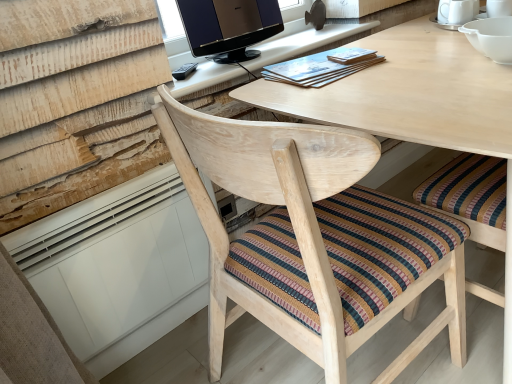
Question: From the image's perspective, is light wood computer desk at upper center beneath matte brown book at upper center, the 2th book from the left?

Choices:
 (A) yes
 (B) no

Answer: (B)

Question: Is light wood computer desk at upper center at the right side of matte brown book at upper center, the 2th book from the left?

Choices:
 (A) no
 (B) yes

Answer: (A)

Question: Is light wood computer desk at upper center not inside matte brown book at upper center, the 2th book from the left?

Choices:
 (A) yes
 (B) no

Answer: (A)

Question: Would you say light wood computer desk at upper center contains matte brown book at upper center, the first book positioned from the right?

Choices:
 (A) no
 (B) yes

Answer: (A)

Question: Is matte brown book at upper center, the first book positioned from the right, at the back of light wood computer desk at upper center?

Choices:
 (A) no
 (B) yes

Answer: (A)

Question: Considering the relative sizes of light wood computer desk at upper center and matte brown book at upper center, the 2th book from the left, in the image provided, is light wood computer desk at upper center smaller than matte brown book at upper center, the 2th book from the left,?

Choices:
 (A) yes
 (B) no

Answer: (B)

Question: Is satin black monitor at upper center a part of matte brown book at upper center, the first book positioned from the right?

Choices:
 (A) yes
 (B) no

Answer: (B)

Question: Considering the relative sizes of matte brown book at upper center, the 2th book from the left, and satin black monitor at upper center in the image provided, is matte brown book at upper center, the 2th book from the left, bigger than satin black monitor at upper center?

Choices:
 (A) no
 (B) yes

Answer: (A)

Question: Considering the relative sizes of matte brown book at upper center, the first book positioned from the right, and satin black monitor at upper center in the image provided, is matte brown book at upper center, the first book positioned from the right, shorter than satin black monitor at upper center?

Choices:
 (A) no
 (B) yes

Answer: (B)

Question: From the image's perspective, is matte brown book at upper center, the 2th book from the left, beneath satin black monitor at upper center?

Choices:
 (A) no
 (B) yes

Answer: (B)

Question: From the image's perspective, would you say matte brown book at upper center, the first book positioned from the right, is positioned over satin black monitor at upper center?

Choices:
 (A) no
 (B) yes

Answer: (A)

Question: Is matte brown book at upper center, the first book positioned from the right, touching satin black monitor at upper center?

Choices:
 (A) yes
 (B) no

Answer: (B)

Question: Is natural wood chair at center to the left of matte wooden book at upper center, the 1th book when ordered from left to right, from the viewer's perspective?

Choices:
 (A) yes
 (B) no

Answer: (A)